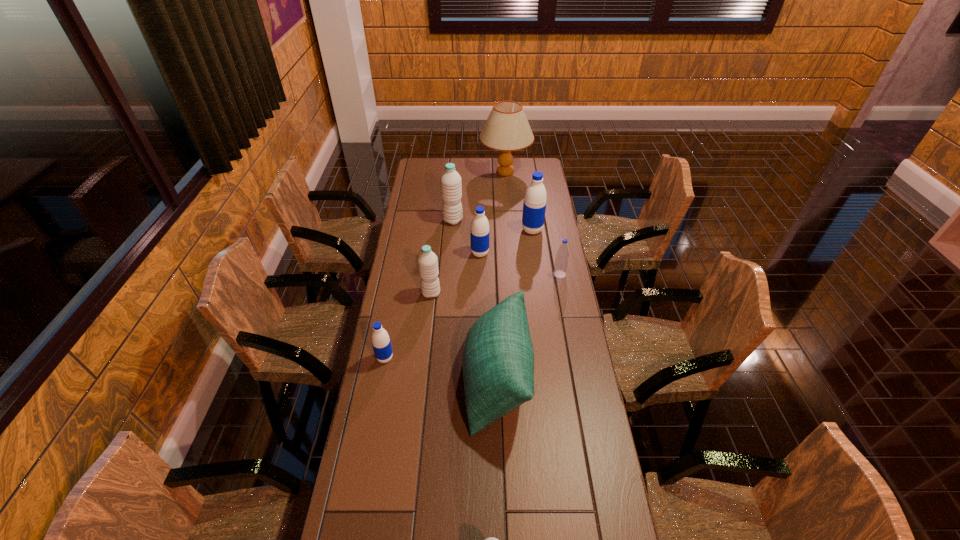
Find the location of a particular element. vacant point located between the fourth farthest water bottle and the second biggest white water bottle is located at coordinates (495, 284).

This screenshot has height=540, width=960. I want to click on empty space that is in between the farthest white water bottle and the second biggest white water bottle, so click(x=442, y=257).

You are a GUI agent. You are given a task and a screenshot of the screen. Output one action in this format:
    pyautogui.click(x=<x>, y=<y>)
    Task: Click on the empty space that is in between the biggest white water bottle and the lampshade
    
    Given the screenshot: What is the action you would take?
    [479, 196]

At what (x,y) coordinates should I click in order to perform the action: click on blank region between the farthest blue water bottle and the fifth farthest object. Please return your answer as a coordinate pair (x, y). The image size is (960, 540). Looking at the image, I should click on (546, 252).

Find the location of a particular element. The height and width of the screenshot is (540, 960). vacant space that's between the sixth farthest water bottle and the beige lampshade is located at coordinates [x=445, y=265].

Image resolution: width=960 pixels, height=540 pixels. I want to click on unoccupied area between the cushion and the farthest white water bottle, so click(x=475, y=300).

In order to click on free space between the nearest blue water bottle and the farthest blue water bottle in this screenshot , I will do `click(459, 294)`.

What are the coordinates of `the seventh closest object to the biggest white water bottle` in the screenshot? It's located at (380, 339).

Find the location of a particular element. object that stands as the seventh closest to the lampshade is located at coordinates (380, 339).

The height and width of the screenshot is (540, 960). Identify the location of the second closest water bottle to the fifth nearest water bottle. (534, 206).